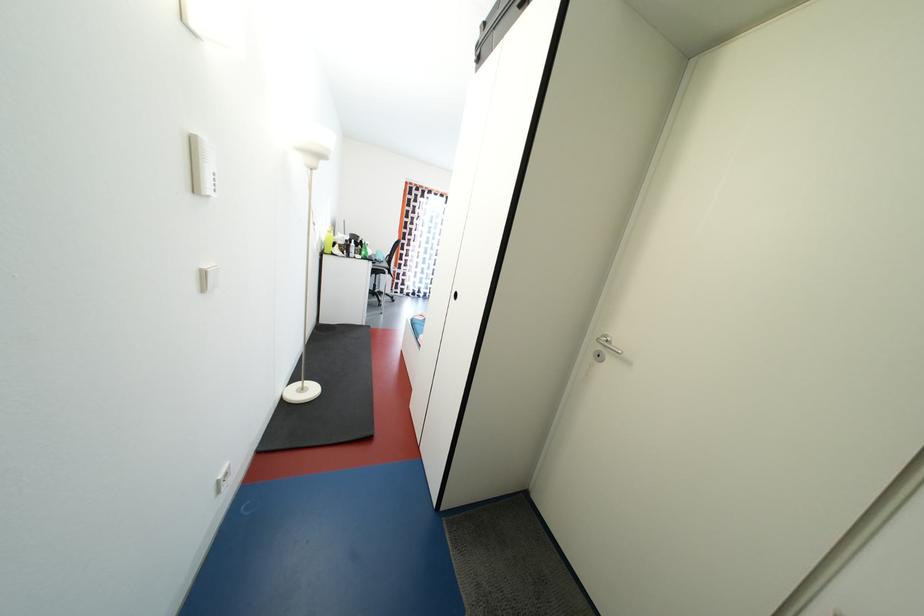
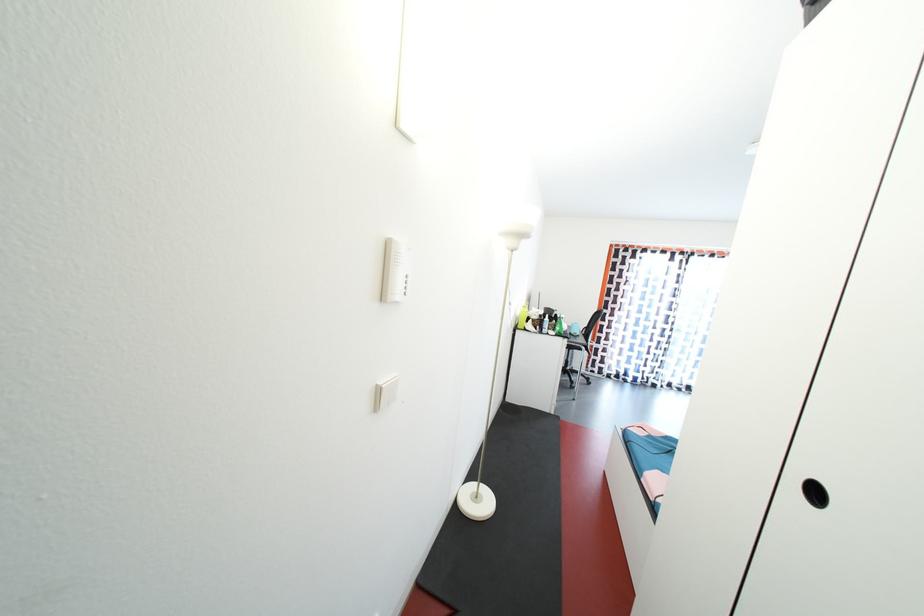
Where in the second image is the point corresponding to point (463, 301) from the first image?

(821, 498)